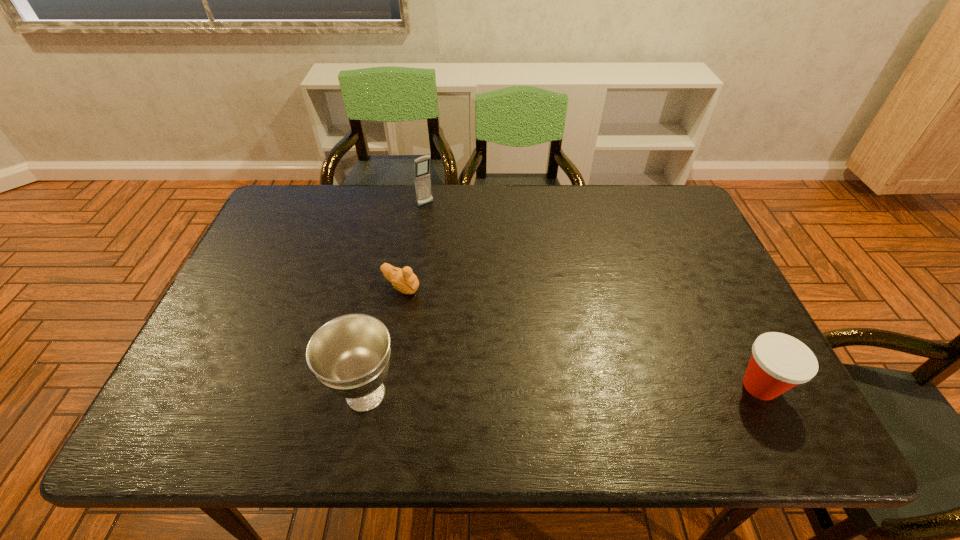
Where is `vacant space at the near edge of the desktop`? The height and width of the screenshot is (540, 960). vacant space at the near edge of the desktop is located at coordinates (695, 397).

What are the coordinates of `free region at the left edge of the desktop` in the screenshot? It's located at (276, 307).

Find the location of `free space at the right edge of the desktop`. free space at the right edge of the desktop is located at coordinates (749, 357).

This screenshot has height=540, width=960. Identify the location of vacant position at the far left corner of the desktop. (302, 216).

This screenshot has width=960, height=540. In order to click on free region at the near left corner in this screenshot , I will do `click(242, 389)`.

Identify the location of vacant space at the far right corner of the desktop. Image resolution: width=960 pixels, height=540 pixels. (644, 192).

The width and height of the screenshot is (960, 540). In order to click on free space between the shortest object and the cellular telephone in this screenshot , I will do `click(414, 246)`.

Where is `unoccupied area between the rightmost object and the second farthest object`? unoccupied area between the rightmost object and the second farthest object is located at coordinates (581, 336).

Where is `unoccupied position between the second shortest object and the second farthest object`? This screenshot has height=540, width=960. unoccupied position between the second shortest object and the second farthest object is located at coordinates 581,336.

Where is `free area in between the chalice and the rightmost object`? The height and width of the screenshot is (540, 960). free area in between the chalice and the rightmost object is located at coordinates (563, 390).